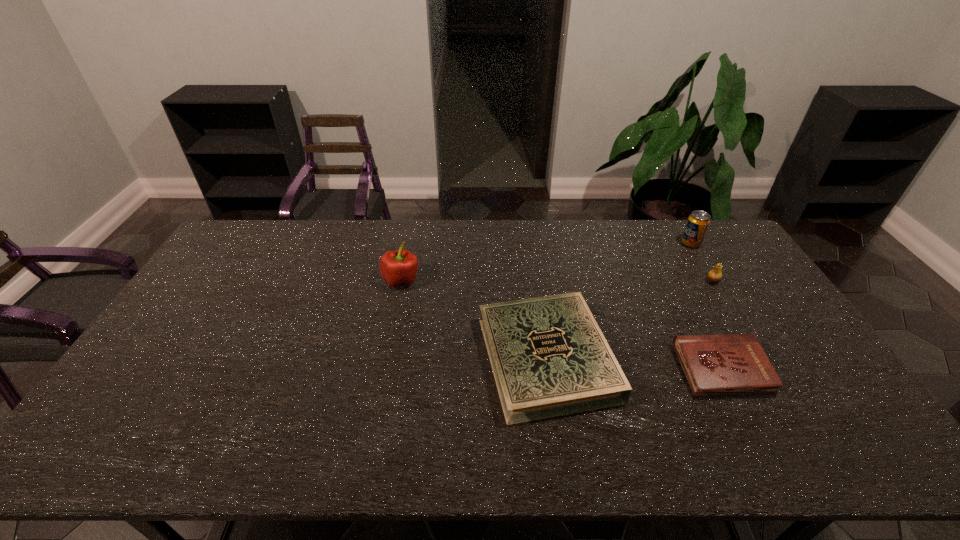
Identify the location of soda can. Image resolution: width=960 pixels, height=540 pixels. (698, 222).

At what (x,y) coordinates should I click in order to perform the action: click on the leftmost object. Please return your answer as a coordinate pair (x, y). The image size is (960, 540). Looking at the image, I should click on (399, 267).

Find the location of `the third shortest object`. the third shortest object is located at coordinates (715, 275).

What are the coordinates of `the fourth tallest object` in the screenshot? It's located at (549, 357).

Image resolution: width=960 pixels, height=540 pixels. I want to click on the left hardback book, so click(x=549, y=357).

This screenshot has height=540, width=960. I want to click on the right hardback book, so click(734, 364).

Where is `the shortest object`? This screenshot has height=540, width=960. the shortest object is located at coordinates (734, 364).

Find the location of a particular element. The width and height of the screenshot is (960, 540). vacant region located 0.240m on the left of the farthest object is located at coordinates (615, 243).

Locate an element on the screen. free region located 0.300m on the left of the leftmost object is located at coordinates (292, 280).

Where is `free region located 0.060m on the front of the pear`? free region located 0.060m on the front of the pear is located at coordinates (723, 299).